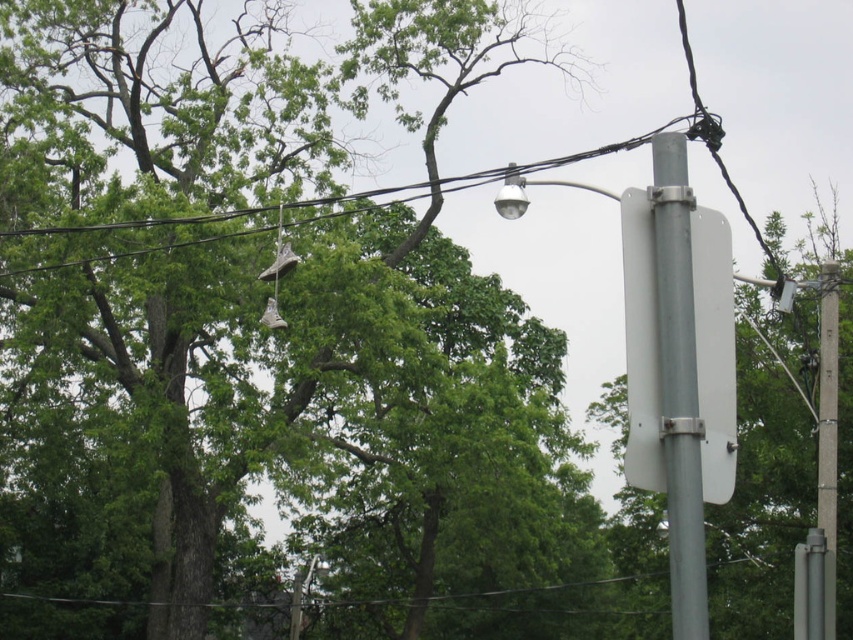
Question: Can you confirm if metallic gray sign at right is positioned above silver metallic pole at right?

Choices:
 (A) yes
 (B) no

Answer: (B)

Question: Which point appears farthest from the camera in this image?

Choices:
 (A) (171, 403)
 (B) (659, 376)
 (C) (668, 419)
 (D) (828, 429)

Answer: (A)

Question: Does silver metallic pole at right have a larger size compared to concrete/rough telegraph pole at right?

Choices:
 (A) yes
 (B) no

Answer: (B)

Question: Is green leafy tree at upper center positioned before concrete/rough telegraph pole at right?

Choices:
 (A) yes
 (B) no

Answer: (A)

Question: Which object appears farthest from the camera in this image?

Choices:
 (A) metallic gray sign at right
 (B) concrete/rough telegraph pole at right
 (C) green leafy tree at upper center
 (D) silver metallic pole at right

Answer: (B)

Question: Which object is the farthest from the green leafy tree at upper center?

Choices:
 (A) silver metallic pole at right
 (B) metallic gray street light at center right
 (C) concrete/rough telegraph pole at right

Answer: (B)